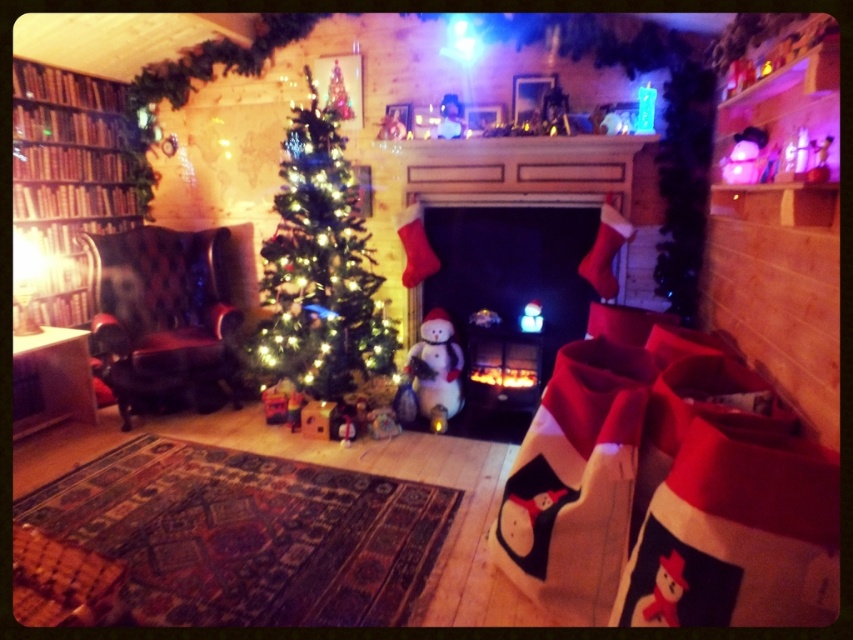
You are a delivery person who needs to place a large package under the green matte christmas tree at center. However, there is a wooden bookshelf at left nearby. Considering their heights, which object is taller and can the package be placed under the tree without hitting the bookshelf?

The green matte christmas tree at center is taller than the wooden bookshelf at left. Since the tree is taller, placing the package under it should be possible as the height difference means the bookshelf is shorter and won

Looking at this image, you are standing in the living room and want to sit in the leather wingback chair at left. What are the coordinates of the chair?

The coordinates of the leather wingback chair at left are at point (163, 317).

You are a guest in the living room and want to place a small gift on the wooden bookshelf at left. Can you reach it from your current position standing in front of the white matte snowman at center without moving your feet?

The wooden bookshelf at left is positioned over the white matte snowman at center, meaning it is above it. Since you are standing in front of the snowman, the bookshelf is likely out of reach unless you can extend your arms upwards. However, without moving your feet, it might be difficult to reach the shelf if it is too high. The answer depends on the height of the bookshelf relative to your arm reach.